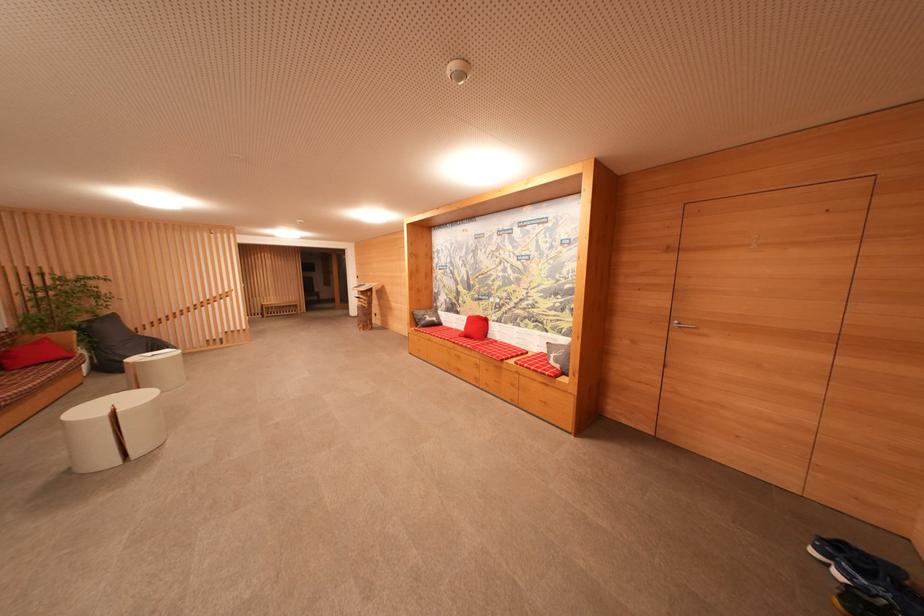
This screenshot has width=924, height=616. What are the coordinates of `small red pillow` in the screenshot? It's located at (476, 326).